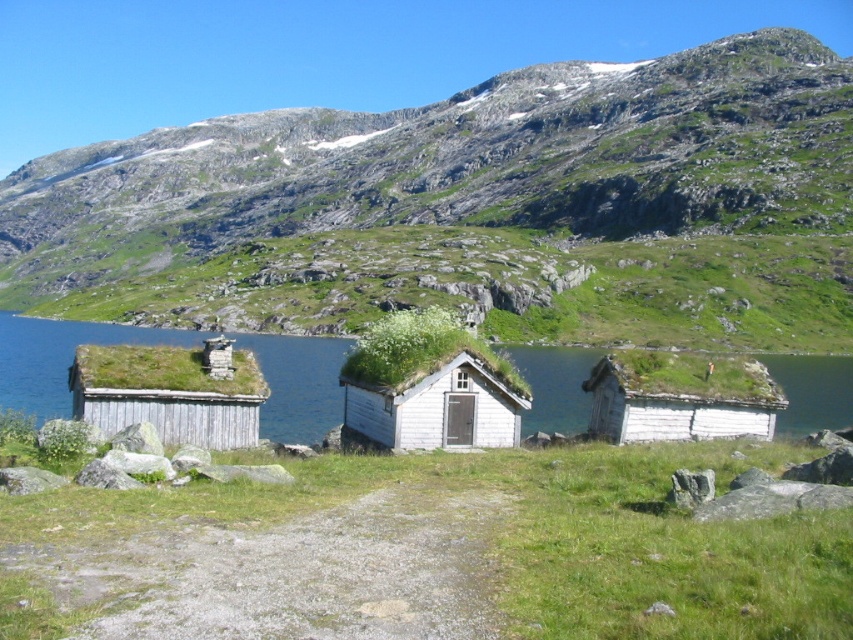
Question: Can you confirm if wooden cabin at left is positioned below green moss-covered cottage at center?

Choices:
 (A) yes
 (B) no

Answer: (B)

Question: Is blue water at center further to the viewer compared to wooden cabin at left?

Choices:
 (A) no
 (B) yes

Answer: (B)

Question: Which of these objects is positioned closest to the green moss-covered cottage at center?

Choices:
 (A) wooden cabin at left
 (B) green grassy mountain at upper center

Answer: (A)

Question: Is green mossy grass at center behind blue water at center?

Choices:
 (A) no
 (B) yes

Answer: (A)

Question: Considering the real-world distances, which object is farthest from the green grassy mountain at upper center?

Choices:
 (A) green moss-covered cottage at center
 (B) green mossy grass at center

Answer: (B)

Question: Which point is farther to the camera?

Choices:
 (A) blue water at center
 (B) green mossy grass at center
 (C) wooden cabin at left

Answer: (A)